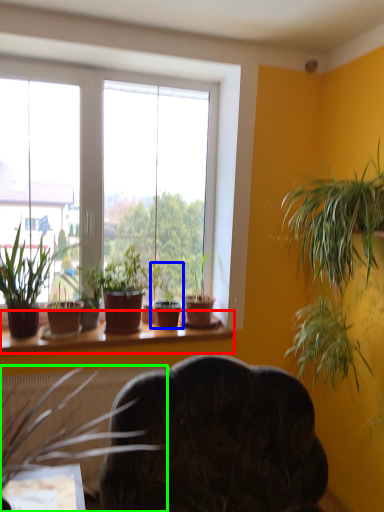
Question: Based on their relative distances, which object is nearer to window sill (highlighted by a red box)? Choose from houseplant (highlighted by a blue box) and houseplant (highlighted by a green box).

Choices:
 (A) houseplant
 (B) houseplant

Answer: (A)